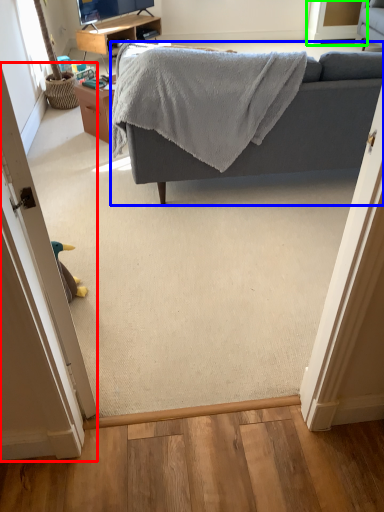
Question: Which object is the farthest from door (highlighted by a red box)? Choose among these: studio couch (highlighted by a blue box) or screen door (highlighted by a green box).

Choices:
 (A) studio couch
 (B) screen door

Answer: (B)